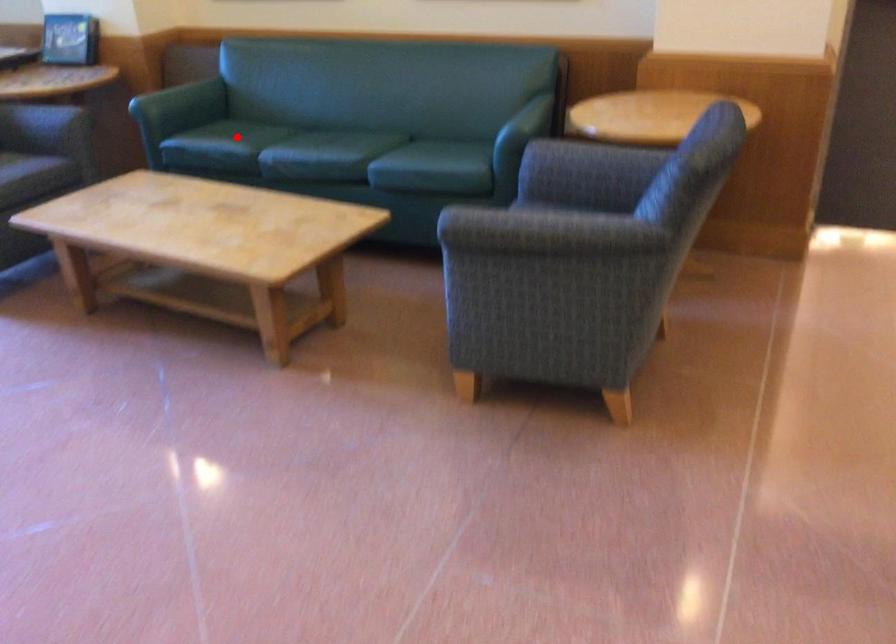
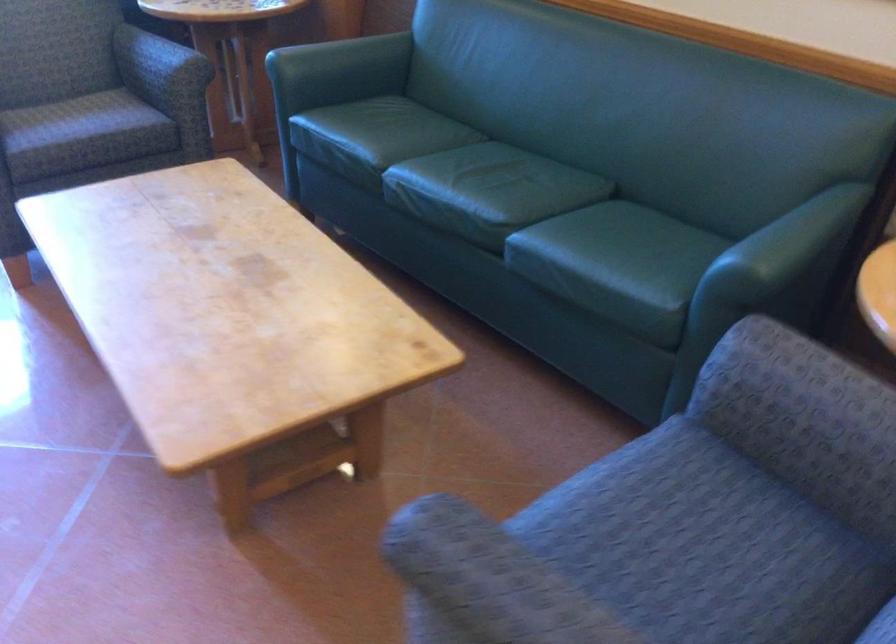
The point at the highlighted location is marked in the first image. Where is the corresponding point in the second image?

(374, 137)